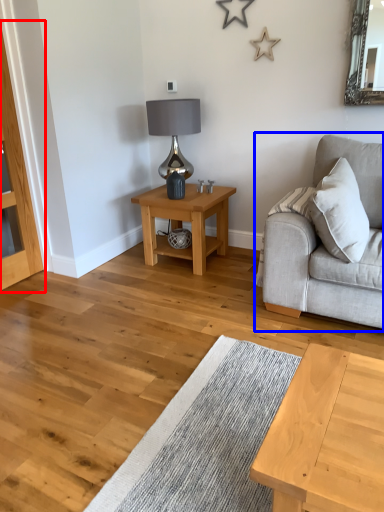
Question: Which point is further to the camera, dresser (highlighted by a red box) or studio couch (highlighted by a blue box)?

Choices:
 (A) dresser
 (B) studio couch

Answer: (A)